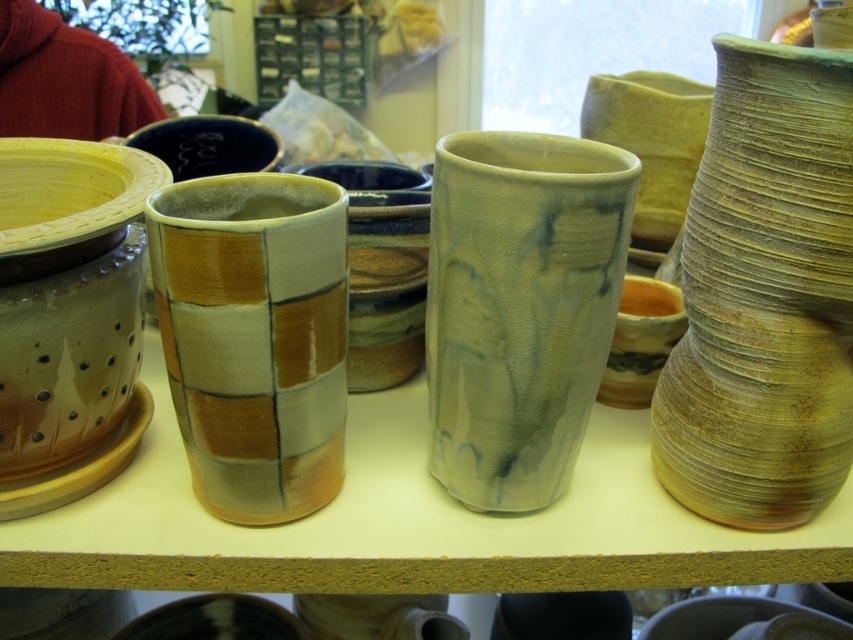
Does matte glazed vase at center appear over matte ceramic vase at center?

Indeed, matte glazed vase at center is positioned over matte ceramic vase at center.

Is matte glazed vase at center wider than matte ceramic vase at center?

Indeed, matte glazed vase at center has a greater width compared to matte ceramic vase at center.

Image resolution: width=853 pixels, height=640 pixels. What do you see at coordinates (519, 307) in the screenshot? I see `matte glazed vase at center` at bounding box center [519, 307].

This screenshot has height=640, width=853. Find the location of `matte glazed vase at center`. matte glazed vase at center is located at coordinates (519, 307).

Who is positioned more to the left, earthy clay vase at right or matte glazed vase at center?

matte glazed vase at center is more to the left.

Can you confirm if earthy clay vase at right is wider than matte glazed vase at center?

In fact, earthy clay vase at right might be narrower than matte glazed vase at center.

Is point (828, 458) less distant than point (445, 440)?

That is True.

What are the coordinates of `earthy clay vase at right` in the screenshot? It's located at (764, 296).

Between earthy clay vase at right and matte ceramic vase at center, which one is positioned lower?

matte ceramic vase at center

Can you confirm if earthy clay vase at right is positioned to the left of matte ceramic vase at center?

In fact, earthy clay vase at right is to the right of matte ceramic vase at center.

Which is in front, point (788, 209) or point (254, 456)?

Positioned in front is point (788, 209).

This screenshot has width=853, height=640. What are the coordinates of `earthy clay vase at right` in the screenshot? It's located at (764, 296).